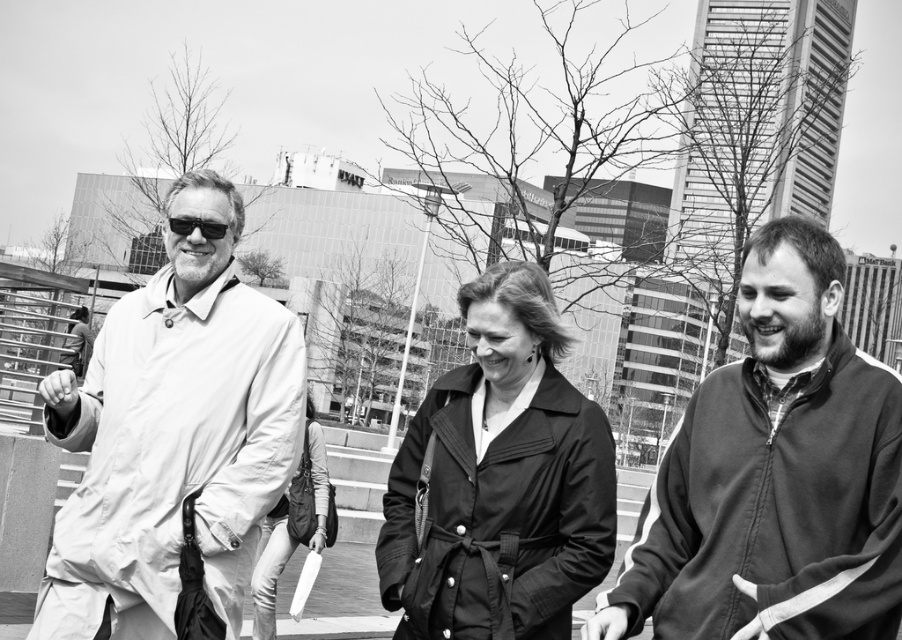
Question: Is matte black coat at center to the right of matte black jacket at center from the viewer's perspective?

Choices:
 (A) yes
 (B) no

Answer: (A)

Question: Based on their relative distances, which object is farther from the matte black sunglasses at left?

Choices:
 (A) matte black jacket at right
 (B) matte black jacket at center
 (C) matte white jacket at center

Answer: (A)

Question: Is matte black coat at center wider than matte black jacket at center?

Choices:
 (A) yes
 (B) no

Answer: (A)

Question: Does matte black jacket at right come in front of matte black coat at center?

Choices:
 (A) yes
 (B) no

Answer: (A)

Question: Which point appears closest to the camera in this image?

Choices:
 (A) pos(530,499)
 (B) pos(210,221)
 (C) pos(798,545)

Answer: (C)

Question: Which of the following is the farthest from the observer?

Choices:
 (A) light beige fabric coat at left
 (B) matte black coat at center
 (C) matte black sunglasses at left
 (D) matte black jacket at right

Answer: (C)